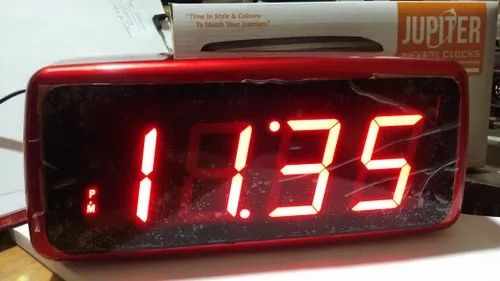
What are the coordinates of `plastic protective film on face of clock` in the screenshot? It's located at (40, 92).